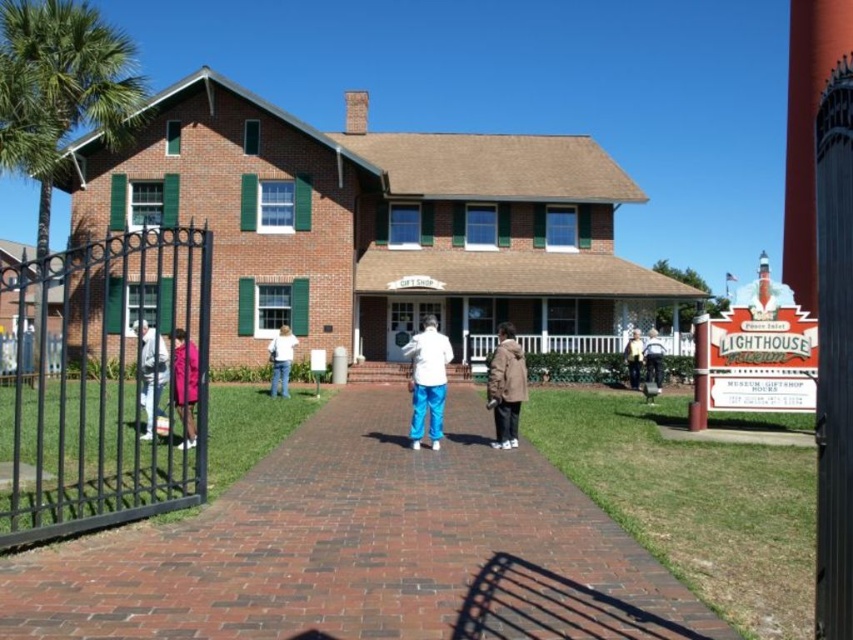
Consider the image. You are a visitor at the Lighthouse Museum and want to enter through the entrance. You see a black wrought iron gate at left and a matte pink coat at left. Which object is taller? Please choose between the two.

The black wrought iron gate at left is much taller than the matte pink coat at left.

You are a photographer standing at the entrance of the Lighthouse Museum. You notice two people wearing a matte pink coat at center and a brown leather jacket at center. Which person is closer to you?

The matte pink coat at center is positioned over the brown leather jacket at center, so the person wearing the matte pink coat at center is closer to you.

You are a photographer planning to take a group photo of the white matte pants at center and the green leafy palm tree at left. Which object is wider so that it can be framed better in the photo?

The green leafy palm tree at left is wider than the white matte pants at center, so it can be framed better in the photo.